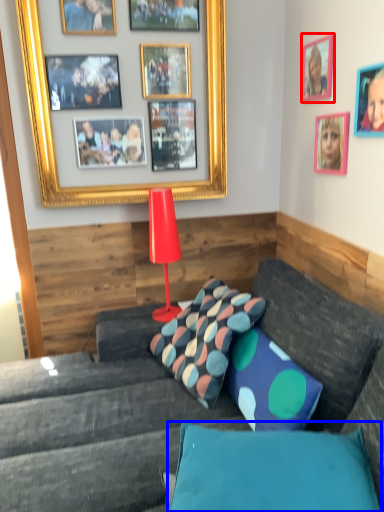
Question: Which object appears closest to the camera in this image, picture frame (highlighted by a red box) or pillow (highlighted by a blue box)?

Choices:
 (A) picture frame
 (B) pillow

Answer: (B)